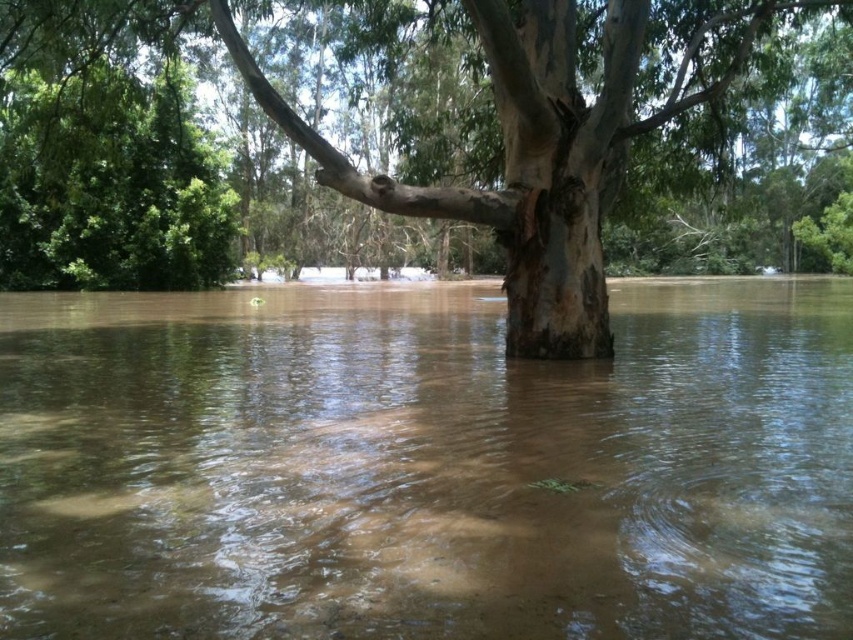
You are a photographer standing at the edge of the flooded area. You want to capture a photo that shows both the brown muddy water at center and the brown rough bark tree at center. Based on their heights, which object will appear taller in the photo?

The brown rough bark tree at center is taller than the brown muddy water at center, so it will appear taller in the photo.

You are a surveyor trying to map the flooded area. You need to determine the exact location of the brown muddy water at center. What are its coordinates?

The brown muddy water at center is located at point [425,465].

You are a rescue worker trying to reach a stranded person on the brown rough bark tree at center. You have a 5 meter long rope. The brown muddy water at center is between you and the tree. Can you safely reach the tree using the rope?

The brown muddy water at center and brown rough bark tree at center are 5.32 meters apart from each other. Since the rope is only 5 meters long, it is not long enough to safely reach the tree.